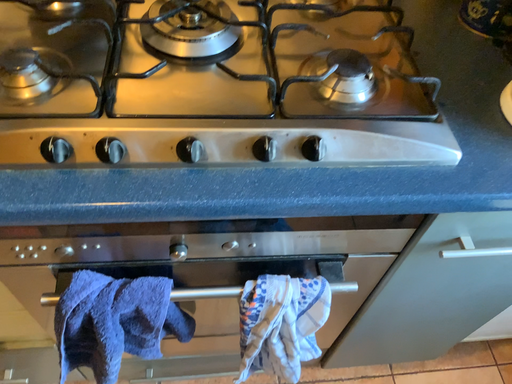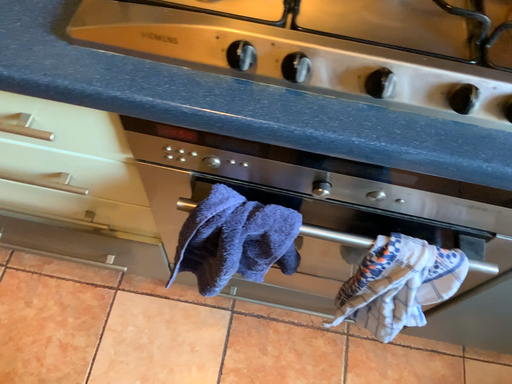
Question: Which way did the camera rotate in the video?

Choices:
 (A) rotated left
 (B) rotated right

Answer: (A)